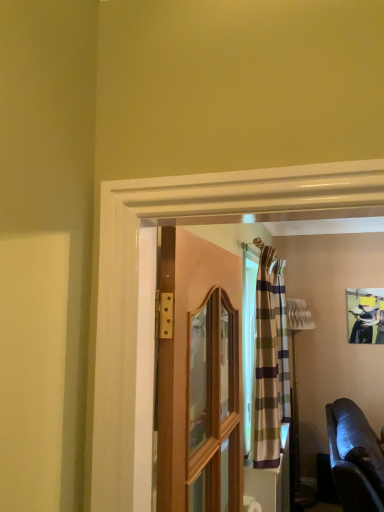
Question: Can you confirm if leather couch at lower right is bigger than wooden door at center?

Choices:
 (A) yes
 (B) no

Answer: (A)

Question: From a real-world perspective, is leather couch at lower right on wooden door at center?

Choices:
 (A) no
 (B) yes

Answer: (A)

Question: Does leather couch at lower right have a smaller size compared to wooden door at center?

Choices:
 (A) no
 (B) yes

Answer: (A)

Question: Does leather couch at lower right touch wooden door at center?

Choices:
 (A) no
 (B) yes

Answer: (A)

Question: Is leather couch at lower right looking in the opposite direction of wooden door at center?

Choices:
 (A) yes
 (B) no

Answer: (B)

Question: From a real-world perspective, is wooden door at center physically located above or below leather couch at lower right?

Choices:
 (A) below
 (B) above

Answer: (B)

Question: Would you say wooden door at center is to the left or to the right of leather couch at lower right in the picture?

Choices:
 (A) right
 (B) left

Answer: (B)

Question: Is wooden door at center inside the boundaries of leather couch at lower right, or outside?

Choices:
 (A) outside
 (B) inside

Answer: (A)

Question: Relative to leather couch at lower right, is wooden door at center in front or behind?

Choices:
 (A) front
 (B) behind

Answer: (A)

Question: Does point tap(365, 472) appear closer or farther from the camera than point tap(345, 303)?

Choices:
 (A) closer
 (B) farther

Answer: (A)

Question: Choose the correct answer: Is leather couch at lower right inside matte black picture frame at upper right or outside it?

Choices:
 (A) outside
 (B) inside

Answer: (A)

Question: Is leather couch at lower right taller or shorter than matte black picture frame at upper right?

Choices:
 (A) tall
 (B) short

Answer: (A)

Question: In terms of width, does leather couch at lower right look wider or thinner when compared to matte black picture frame at upper right?

Choices:
 (A) wide
 (B) thin

Answer: (A)

Question: Is striped fabric curtain at center taller or shorter than wooden door at center?

Choices:
 (A) tall
 (B) short

Answer: (A)

Question: Is striped fabric curtain at center in front of or behind wooden door at center in the image?

Choices:
 (A) front
 (B) behind

Answer: (B)